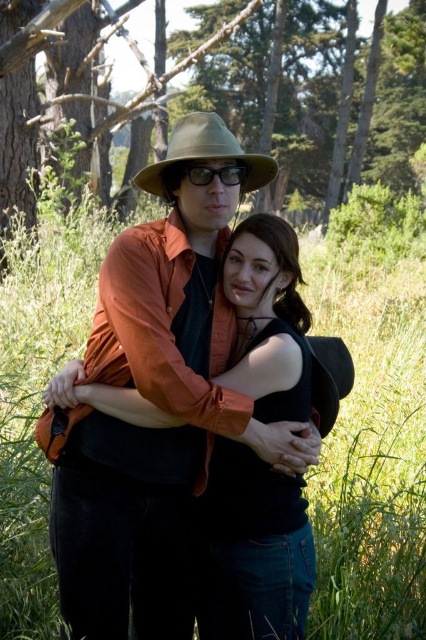
Can you confirm if green grass at center is bigger than matte black goggles at center?

Correct, green grass at center is larger in size than matte black goggles at center.

This screenshot has width=426, height=640. Describe the element at coordinates (371, 420) in the screenshot. I see `green grass at center` at that location.

Is point (359, 228) closer to viewer compared to point (206, 179)?

No, (359, 228) is further to viewer.

In order to click on green grass at center in this screenshot , I will do `click(371, 420)`.

Measure the distance between green grass at center and brown wood tree at upper center.

green grass at center is 49.23 feet from brown wood tree at upper center.

Is the position of green grass at center more distant than that of brown wood tree at upper center?

No, green grass at center is in front of brown wood tree at upper center.

Is point (143, 209) farther from camera compared to point (308, 188)?

No, (143, 209) is in front of (308, 188).

Identify the location of green grass at center. The height and width of the screenshot is (640, 426). (371, 420).

Does brown wood tree at upper center have a smaller size compared to matte khaki cowboy hat at center?

No.

Does point (221, 67) come closer to viewer compared to point (155, 188)?

No, (221, 67) is further to viewer.

Which is behind, point (287, 140) or point (215, 129)?

The point (287, 140) is behind.

I want to click on brown wood tree at upper center, so click(397, 106).